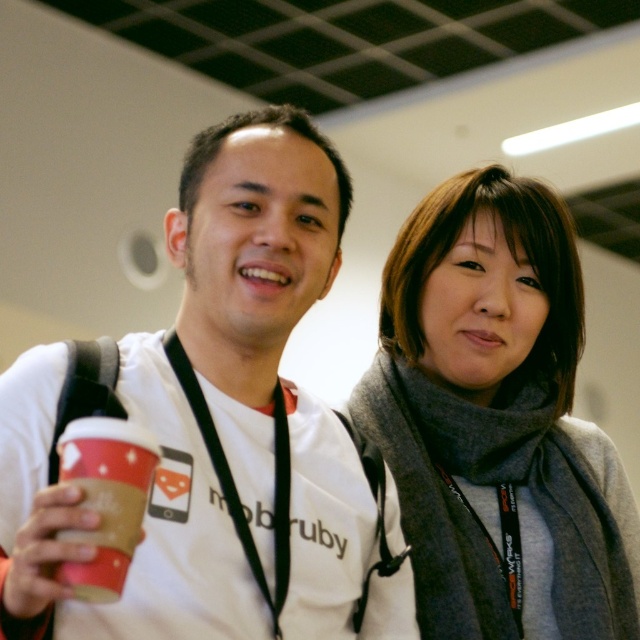
Can you confirm if gray wool scarf at upper right is taller than brown paper cup at left?

Correct, gray wool scarf at upper right is much taller as brown paper cup at left.

Can you confirm if gray wool scarf at upper right is positioned below brown paper cup at left?

No, gray wool scarf at upper right is not below brown paper cup at left.

Is point (563, 628) farther from camera compared to point (93, 564)?

Yes, point (563, 628) is behind point (93, 564).

At what (x,y) coordinates should I click in order to perform the action: click on gray wool scarf at upper right. Please return your answer as a coordinate pair (x, y). This screenshot has width=640, height=640. Looking at the image, I should click on (497, 420).

Where is `white matte t-shirt at center`? white matte t-shirt at center is located at coordinates (220, 428).

Is white matte t-shirt at center further to camera compared to gray wool scarf at upper right?

No, it is not.

This screenshot has width=640, height=640. What do you see at coordinates (220, 428) in the screenshot?
I see `white matte t-shirt at center` at bounding box center [220, 428].

Locate an element on the screen. This screenshot has width=640, height=640. white matte t-shirt at center is located at coordinates (220, 428).

Does white matte t-shirt at center come behind brown paper cup at left?

No, it is not.

Is white matte t-shirt at center closer to the viewer compared to brown paper cup at left?

Yes, it is in front of brown paper cup at left.

Find the location of `white matte t-shirt at center`. white matte t-shirt at center is located at coordinates (220, 428).